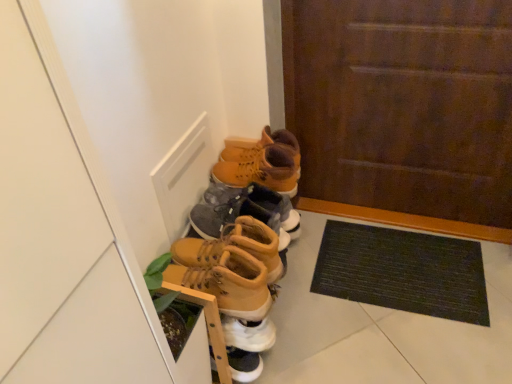
Question: Is matte yellow leather boots at center, the fifth footwear ordered from the bottom, wider than matte yellow boots at center, which ranks as the 2th footwear in top-to-bottom order?

Choices:
 (A) yes
 (B) no

Answer: (B)

Question: Is matte yellow leather boots at center, positioned as the first footwear in top-to-bottom order, looking in the opposite direction of matte yellow boots at center, which ranks as the 2th footwear in top-to-bottom order?

Choices:
 (A) no
 (B) yes

Answer: (A)

Question: Considering the relative sizes of matte yellow leather boots at center, the fifth footwear ordered from the bottom, and matte yellow boots at center, which is the 4th footwear from bottom to top, in the image provided, is matte yellow leather boots at center, the fifth footwear ordered from the bottom, taller than matte yellow boots at center, which is the 4th footwear from bottom to top,?

Choices:
 (A) no
 (B) yes

Answer: (B)

Question: Does matte yellow leather boots at center, the fifth footwear ordered from the bottom, appear on the left side of matte yellow boots at center, which ranks as the 2th footwear in top-to-bottom order?

Choices:
 (A) no
 (B) yes

Answer: (A)

Question: Does matte yellow leather boots at center, positioned as the first footwear in top-to-bottom order, turn towards matte yellow boots at center, which is the 4th footwear from bottom to top?

Choices:
 (A) no
 (B) yes

Answer: (A)

Question: Is matte brown boot at center, which appears as the second footwear when ordered from the bottom, situated inside matte yellow boots at center, which is the 4th footwear from bottom to top, or outside?

Choices:
 (A) inside
 (B) outside

Answer: (B)

Question: From a real-world perspective, relative to matte yellow boots at center, which is the 4th footwear from bottom to top, is matte brown boot at center, acting as the fourth footwear starting from the top, vertically above or below?

Choices:
 (A) above
 (B) below

Answer: (B)

Question: Is matte brown boot at center, which appears as the second footwear when ordered from the bottom, bigger or smaller than matte yellow boots at center, which ranks as the 2th footwear in top-to-bottom order?

Choices:
 (A) small
 (B) big

Answer: (B)

Question: Considering the positions of point pyautogui.click(x=256, y=362) and point pyautogui.click(x=254, y=210), is point pyautogui.click(x=256, y=362) closer or farther from the camera than point pyautogui.click(x=254, y=210)?

Choices:
 (A) closer
 (B) farther

Answer: (B)

Question: Considering their positions, is matte brown boot at center, acting as the fourth footwear starting from the top, located in front of or behind brown wooden door at center?

Choices:
 (A) front
 (B) behind

Answer: (A)

Question: From the image's perspective, is matte brown boot at center, acting as the fourth footwear starting from the top, positioned above or below brown wooden door at center?

Choices:
 (A) below
 (B) above

Answer: (A)

Question: Considering the positions of point (217, 259) and point (340, 16), is point (217, 259) closer or farther from the camera than point (340, 16)?

Choices:
 (A) farther
 (B) closer

Answer: (B)

Question: Looking at their shapes, would you say matte brown boot at center, acting as the fourth footwear starting from the top, is wider or thinner than brown wooden door at center?

Choices:
 (A) wide
 (B) thin

Answer: (A)

Question: Looking at the image, does matte brown boot at center, which appears as the second footwear when ordered from the bottom, seem bigger or smaller compared to leather tan boots at center, which is the first footwear in bottom-to-top order?

Choices:
 (A) big
 (B) small

Answer: (A)

Question: Considering the positions of point (263, 182) and point (271, 301), is point (263, 182) closer or farther from the camera than point (271, 301)?

Choices:
 (A) closer
 (B) farther

Answer: (A)